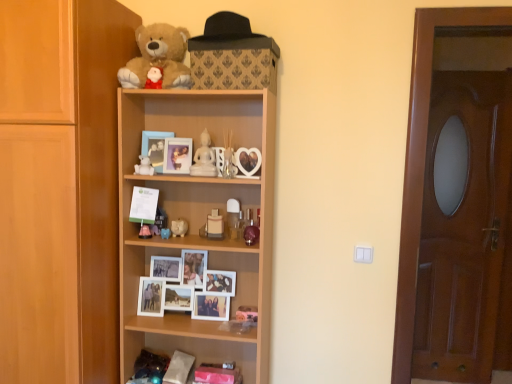
Question: Considering the relative sizes of white wooden photo frames at center, positioned as the 1th shelf in bottom-to-top order, and translucent glass vase at center, arranged as the first toy when viewed from the right, in the image provided, is white wooden photo frames at center, positioned as the 1th shelf in bottom-to-top order, bigger than translucent glass vase at center, arranged as the first toy when viewed from the right,?

Choices:
 (A) no
 (B) yes

Answer: (B)

Question: Is white wooden photo frames at center, arranged as the second shelf when viewed from the top, thinner than translucent glass vase at center, marked as the fifth toy in a left-to-right arrangement?

Choices:
 (A) no
 (B) yes

Answer: (A)

Question: Is the position of white wooden photo frames at center, arranged as the second shelf when viewed from the top, more distant than that of translucent glass vase at center, arranged as the first toy when viewed from the right?

Choices:
 (A) no
 (B) yes

Answer: (B)

Question: Is white wooden photo frames at center, arranged as the second shelf when viewed from the top, far away from translucent glass vase at center, marked as the fifth toy in a left-to-right arrangement?

Choices:
 (A) yes
 (B) no

Answer: (B)

Question: Can you confirm if white wooden photo frames at center, arranged as the second shelf when viewed from the top, is wider than translucent glass vase at center, arranged as the first toy when viewed from the right?

Choices:
 (A) yes
 (B) no

Answer: (A)

Question: Does white wooden photo frames at center, arranged as the second shelf when viewed from the top, have a lesser height compared to translucent glass vase at center, arranged as the first toy when viewed from the right?

Choices:
 (A) no
 (B) yes

Answer: (A)

Question: Are brown wooden door at right and translucent glass vase at center, marked as the fifth toy in a left-to-right arrangement, making contact?

Choices:
 (A) yes
 (B) no

Answer: (B)

Question: Does brown wooden door at right have a smaller size compared to translucent glass vase at center, marked as the fifth toy in a left-to-right arrangement?

Choices:
 (A) yes
 (B) no

Answer: (B)

Question: Is brown wooden door at right far from translucent glass vase at center, arranged as the first toy when viewed from the right?

Choices:
 (A) no
 (B) yes

Answer: (A)

Question: Does brown wooden door at right turn towards translucent glass vase at center, marked as the fifth toy in a left-to-right arrangement?

Choices:
 (A) yes
 (B) no

Answer: (B)

Question: Can you confirm if brown wooden door at right is wider than translucent glass vase at center, marked as the fifth toy in a left-to-right arrangement?

Choices:
 (A) yes
 (B) no

Answer: (A)

Question: Is brown wooden door at right bigger than translucent glass vase at center, arranged as the first toy when viewed from the right?

Choices:
 (A) yes
 (B) no

Answer: (A)

Question: Is the depth of white glossy figurine at upper center less than that of translucent glass vase at center, marked as the fifth toy in a left-to-right arrangement?

Choices:
 (A) yes
 (B) no

Answer: (B)